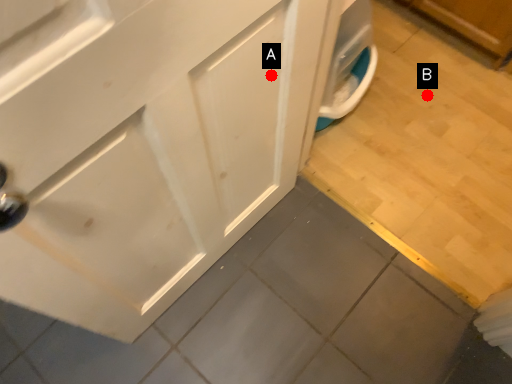
Question: Two points are circled on the image, labeled by A and B beside each circle. Which point is closer to the camera?

Choices:
 (A) A is closer
 (B) B is closer

Answer: (A)